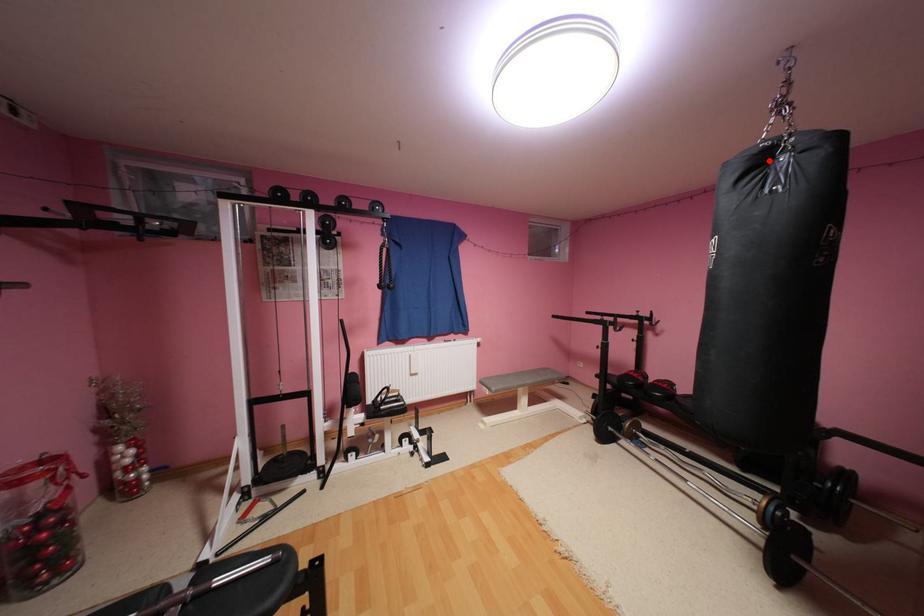
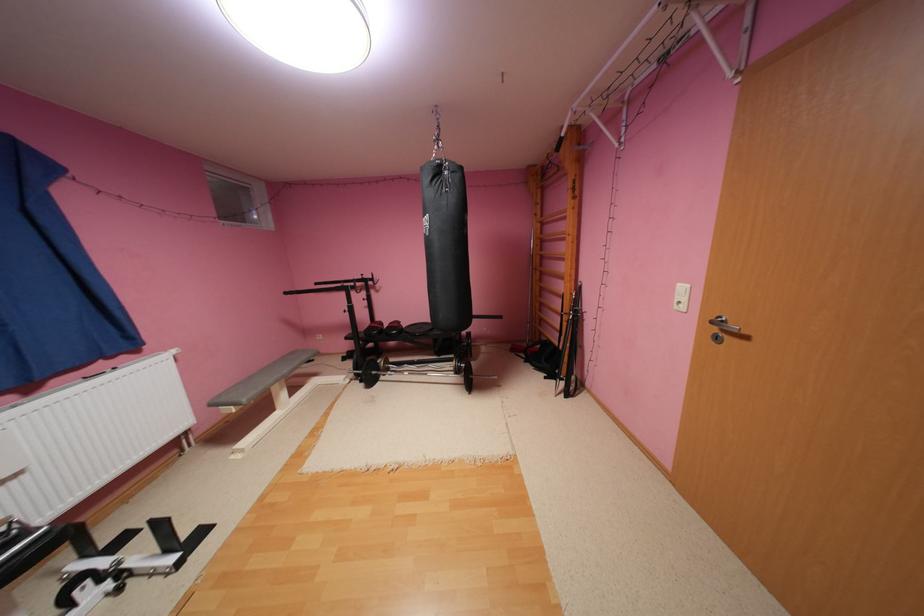
Question: I am providing you with two images of the same scene from different viewpoints. In image1, a red point is highlighted. Considering the same 3D point in image2, which of the following is correct?

Choices:
 (A) It is closer
 (B) It is farther

Answer: (A)